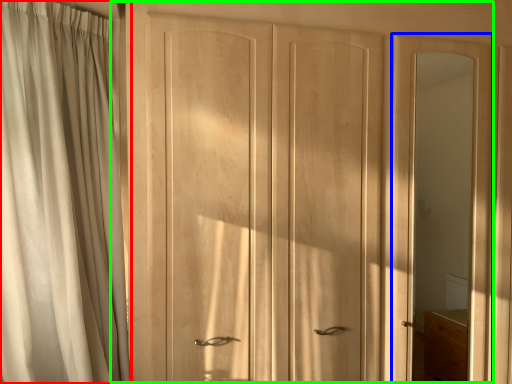
Question: Which is farther away from curtain (highlighted by a red box)? screen door (highlighted by a blue box) or door (highlighted by a green box)?

Choices:
 (A) screen door
 (B) door

Answer: (A)